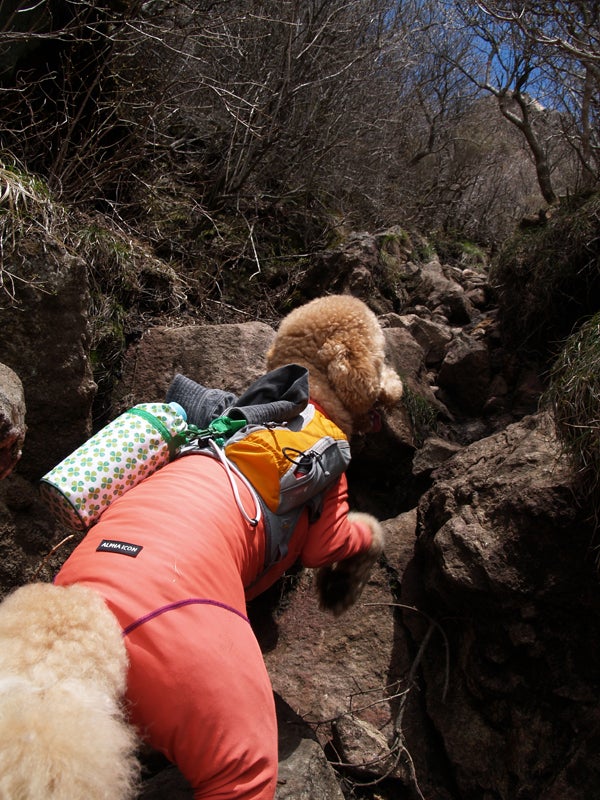
Where is `bottle`? The height and width of the screenshot is (800, 600). bottle is located at coordinates (127, 448).